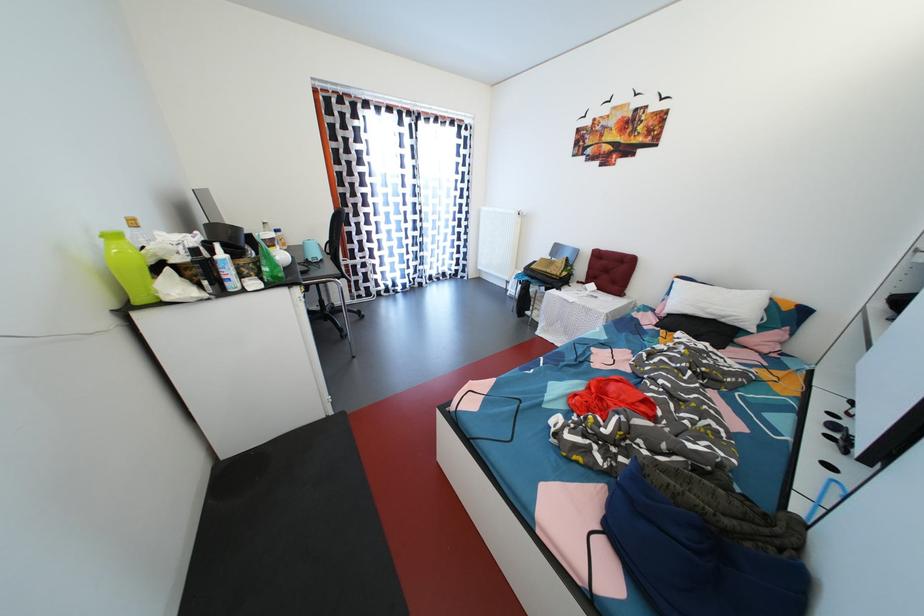
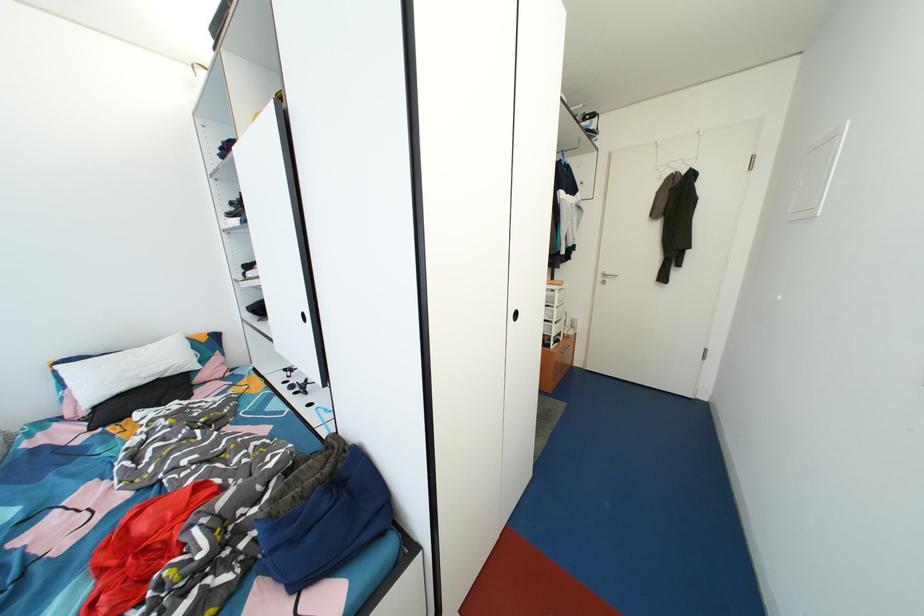
Find the pixel in the second image that matches point 730,318 in the first image.

(167, 373)